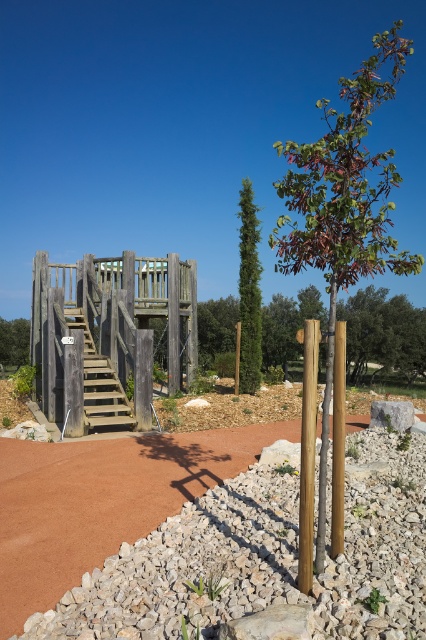
You are a child trying to build a small sandcastle on the playground. You have two options for materials available here. One is the brown gravel at lower left and the other is the brown wooden tree at left. Which material would be more suitable for building the base of your sandcastle?

The brown gravel at lower left has a lesser height compared to the brown wooden tree at left, so the brown gravel at lower left would be more suitable for building the base of the sandcastle since it is flatter and provides a stable foundation.

You are a parent trying to decide whether to let your child play near the green textured tree at center and the wooden stairs at center. Considering their sizes, which one is bigger?

The green textured tree at center is larger in size than the wooden stairs at center, so the tree is bigger.